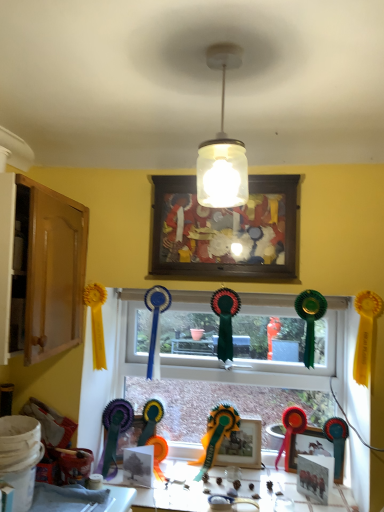
Where is `free spot in front of matte plastic picture frame at lower right, which appears as the second picture frame when viewed from the back`? The image size is (384, 512). free spot in front of matte plastic picture frame at lower right, which appears as the second picture frame when viewed from the back is located at coordinates (328, 495).